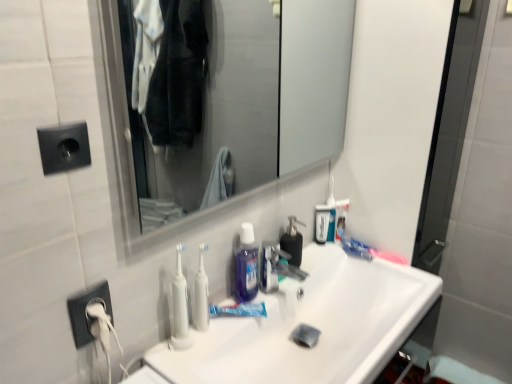
Question: Considering the positions of black plastic socket at upper left, marked as the 2th electric outlet in a back-to-front arrangement, and pink plastic toothbrush at upper right, which ranks as the second toothbrush in left-to-right order, in the image, is black plastic socket at upper left, marked as the 2th electric outlet in a back-to-front arrangement, taller or shorter than pink plastic toothbrush at upper right, which ranks as the second toothbrush in left-to-right order,?

Choices:
 (A) tall
 (B) short

Answer: (A)

Question: Based on their sizes in the image, would you say black plastic socket at upper left, acting as the first electric outlet starting from the front, is bigger or smaller than pink plastic toothbrush at upper right, which ranks as the second toothbrush in left-to-right order?

Choices:
 (A) big
 (B) small

Answer: (B)

Question: Which is farther from the clear glass mirror at upper center?

Choices:
 (A) transparent plastic mouthwash at center, the 3th mouthwash positioned from the front
 (B) black plastic socket at upper left, marked as the 1th electric outlet in a top-to-bottom arrangement
 (C) black plastic electric outlet at lower left, placed as the 2th electric outlet when sorted from top to bottom
 (D) translucent purple mouthwash at center, arranged as the third mouthwash when viewed from the right
 (E) blue glossy toothpaste at center

Answer: (B)

Question: Which object is positioned closest to the white plastic toothbrush at center, the first toothbrush viewed from the front?

Choices:
 (A) translucent purple mouthwash at center, positioned as the first mouthwash in left-to-right order
 (B) pink plastic toothbrush at upper right, placed as the 1th toothbrush when sorted from right to left
 (C) black matte soap dispenser at center
 (D) blue glossy toothpaste at center
 (E) black plastic electric outlet at lower left, placed as the 2th electric outlet when sorted from top to bottom

Answer: (A)